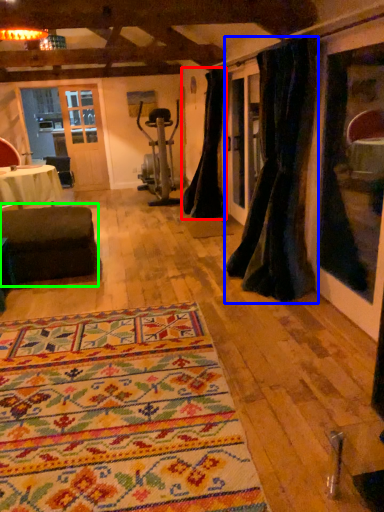
Question: Which is nearer to the curtain (highlighted by a red box)? curtain (highlighted by a blue box) or studio couch (highlighted by a green box).

Choices:
 (A) curtain
 (B) studio couch

Answer: (A)